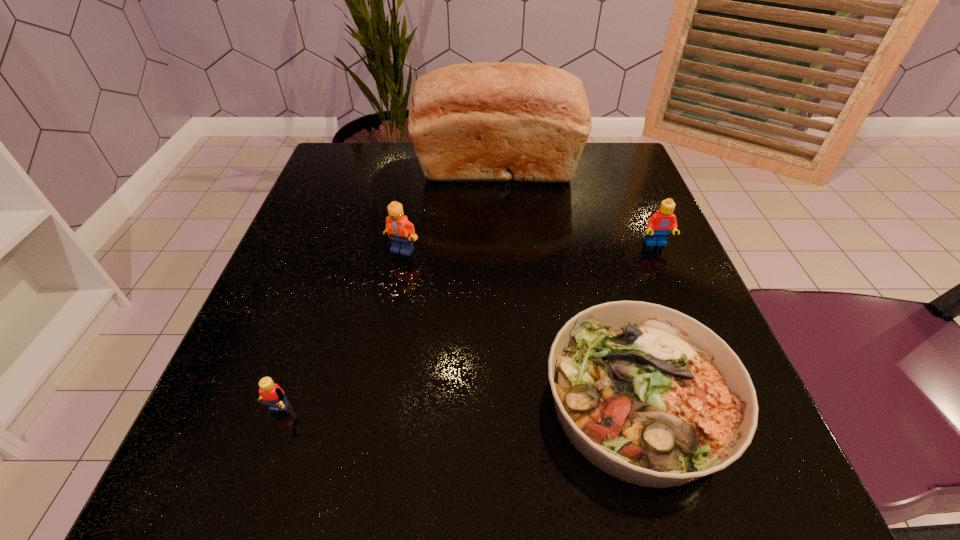
The height and width of the screenshot is (540, 960). What are the coordinates of `bread` in the screenshot? It's located at (483, 121).

Locate an element on the screen. the farthest object is located at coordinates (483, 121).

Identify the location of the second Lego from right to left. This screenshot has height=540, width=960. (401, 231).

I want to click on the rightmost Lego, so click(x=660, y=224).

Image resolution: width=960 pixels, height=540 pixels. I want to click on the nearest Lego, so click(x=272, y=395).

At what (x,y) coordinates should I click in order to perform the action: click on the leftmost object. Please return your answer as a coordinate pair (x, y). Image resolution: width=960 pixels, height=540 pixels. Looking at the image, I should click on (272, 395).

Find the location of a particular element. The width and height of the screenshot is (960, 540). the shortest object is located at coordinates (649, 395).

Find the location of a particular element. free space located on the left of the tallest object is located at coordinates (395, 171).

Where is `vacant position located 0.390m on the front-facing side of the second Lego from right to left`? This screenshot has height=540, width=960. vacant position located 0.390m on the front-facing side of the second Lego from right to left is located at coordinates (359, 486).

Identify the location of blank space located on the face of the rightmost Lego. (704, 356).